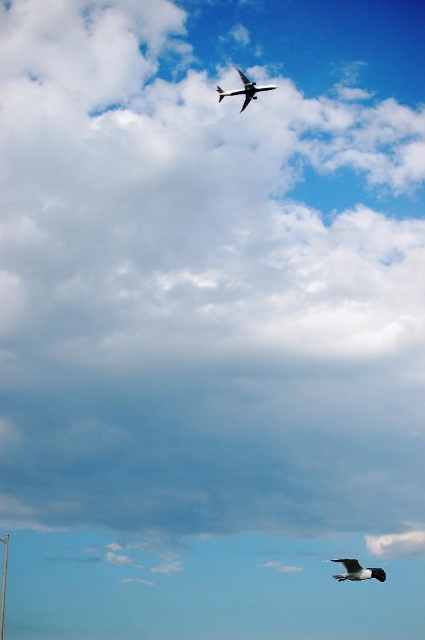
Question: Is white feathered bird at lower center below metallic silver airplane at upper center?

Choices:
 (A) no
 (B) yes

Answer: (B)

Question: Does white feathered bird at lower center have a larger size compared to metallic silver airplane at upper center?

Choices:
 (A) no
 (B) yes

Answer: (A)

Question: Which point is farther to the camera?

Choices:
 (A) (266, 86)
 (B) (354, 560)

Answer: (A)

Question: Does white feathered bird at lower center have a larger size compared to metallic silver airplane at upper center?

Choices:
 (A) yes
 (B) no

Answer: (B)